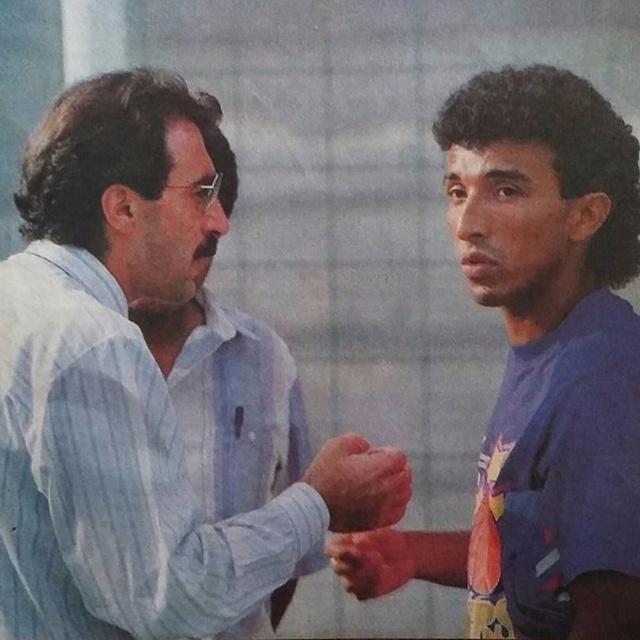
You are a photographer adjusting lighting for a portrait session. You need to ensure that the blue matte shirt at right and the matte skin hand at center are both well lit. Given their sizes, which object should you focus more light on to ensure proper exposure?

The blue matte shirt at right has a larger size compared to the matte skin hand at center, so you should focus more light on the blue matte shirt at right to ensure proper exposure.

You are a photographer trying to capture a portrait of both individuals in the image. You want to ensure that both the blue striped shirt at center and the blue matte shirt at right are clearly visible in the photo. Based on their positions, which person should you adjust to bring them into focus?

The blue matte shirt at right is behind blue striped shirt at center, so you should move the person in the blue matte shirt at right forward to ensure both are in focus.

You are a photographer trying to capture a closeup shot of both the matte skin hand at center and the smooth skin hand at center. Since you want to ensure both hands are in focus, you need to know their height difference. Which hand is taller?

The matte skin hand at center is taller than the smooth skin hand at center.